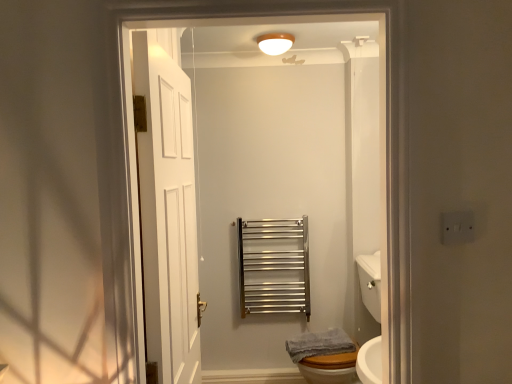
Question: Is the depth of white glossy sink at lower right greater than that of gray cotton towel at lower right?

Choices:
 (A) yes
 (B) no

Answer: (B)

Question: From the image's perspective, would you say white glossy sink at lower right is shown under gray cotton towel at lower right?

Choices:
 (A) yes
 (B) no

Answer: (B)

Question: From the image's perspective, is white glossy sink at lower right on top of gray cotton towel at lower right?

Choices:
 (A) no
 (B) yes

Answer: (B)

Question: Can you confirm if white glossy sink at lower right is bigger than gray cotton towel at lower right?

Choices:
 (A) no
 (B) yes

Answer: (B)

Question: Would you consider white glossy sink at lower right to be distant from gray cotton towel at lower right?

Choices:
 (A) yes
 (B) no

Answer: (B)

Question: Can you confirm if white glossy sink at lower right is positioned to the right of gray cotton towel at lower right?

Choices:
 (A) no
 (B) yes

Answer: (B)

Question: Can you confirm if white wooden door at left, which ranks as the 2th door in front-to-back order, is wider than white glossy sink at lower right?

Choices:
 (A) yes
 (B) no

Answer: (B)

Question: Is white wooden door at left, which ranks as the 2th door in front-to-back order, not within white glossy sink at lower right?

Choices:
 (A) no
 (B) yes

Answer: (B)

Question: From a real-world perspective, is white wooden door at left, the 1th door viewed from the left, on top of white glossy sink at lower right?

Choices:
 (A) no
 (B) yes

Answer: (B)

Question: Is white wooden door at left, which ranks as the 2th door in front-to-back order, aimed at white glossy sink at lower right?

Choices:
 (A) no
 (B) yes

Answer: (A)

Question: Can you confirm if white wooden door at left, the second door in the right-to-left sequence, is shorter than white glossy sink at lower right?

Choices:
 (A) yes
 (B) no

Answer: (B)

Question: Can you confirm if white wooden door at left, the second door in the right-to-left sequence, is positioned to the left of white glossy sink at lower right?

Choices:
 (A) no
 (B) yes

Answer: (B)

Question: Can you confirm if satin nickel towel rail at center is shorter than white glossy sink at lower right?

Choices:
 (A) no
 (B) yes

Answer: (B)